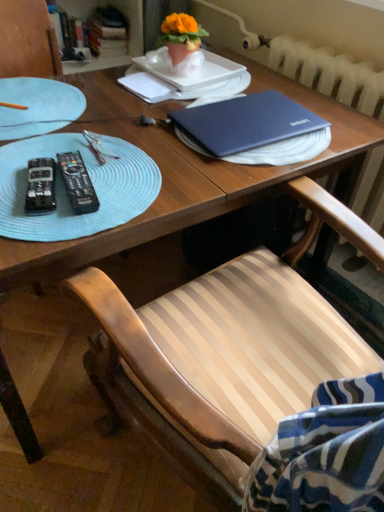
Identify the location of free spot to the right of black plastic remote control at left, the first remote control viewed from the right. (150, 184).